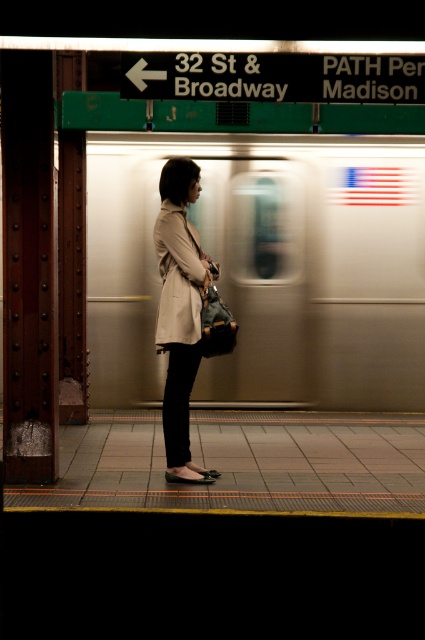
Which is in front, point (181, 328) or point (178, 221)?

Point (181, 328) is more forward.

Does beige fabric coat at center appear on the right side of beige fabric trench coat at center?

Correct, you'll find beige fabric coat at center to the right of beige fabric trench coat at center.

The height and width of the screenshot is (640, 425). What are the coordinates of `beige fabric coat at center` in the screenshot? It's located at (181, 310).

Is silver metallic train at center shorter than metallic green sign at upper center?

In fact, silver metallic train at center may be taller than metallic green sign at upper center.

Does point (308, 324) come farther from viewer compared to point (297, 76)?

That is True.

Which is behind, point (155, 204) or point (374, 93)?

Point (155, 204)

The image size is (425, 640). Find the location of `silver metallic train at center`. silver metallic train at center is located at coordinates (266, 268).

Is point (124, 292) positioned in front of point (206, 294)?

That is False.

What do you see at coordinates (266, 268) in the screenshot?
I see `silver metallic train at center` at bounding box center [266, 268].

Locate an element on the screen. silver metallic train at center is located at coordinates (266, 268).